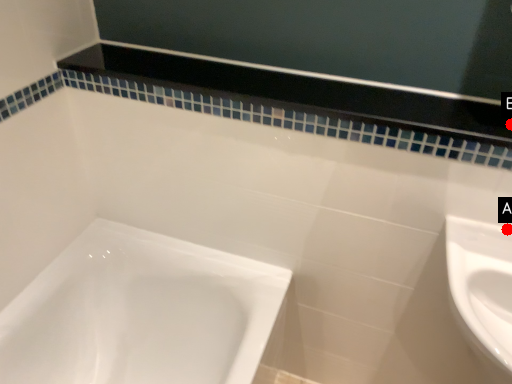
Question: Two points are circled on the image, labeled by A and B beside each circle. Among these points, which one is nearest to the camera?

Choices:
 (A) A is closer
 (B) B is closer

Answer: (B)